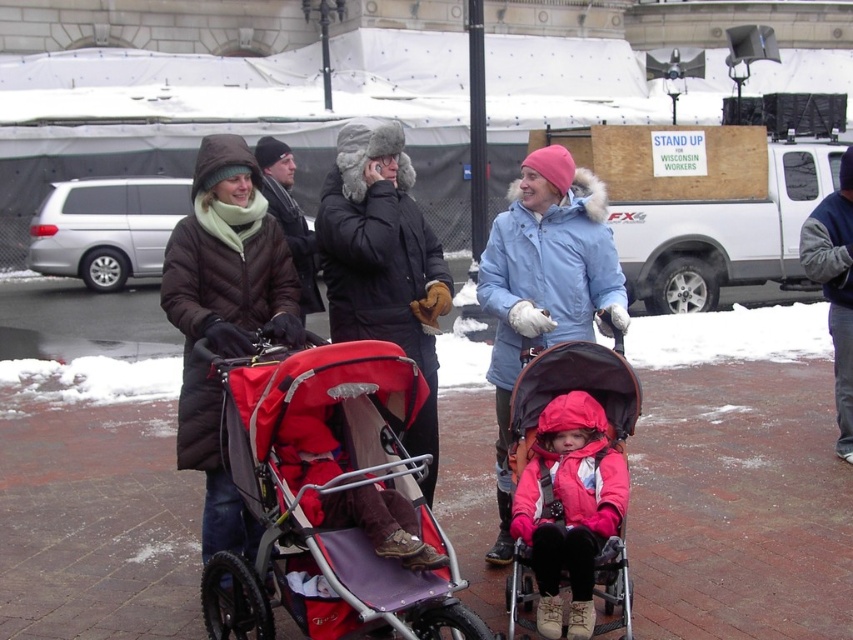
You are a delivery person with a cart that is 8 feet wide. You need to move through the space between the brick pavement at center and the matte red stroller at center. Can your cart fit through that space?

The distance between the brick pavement at center and the matte red stroller at center is 7.99 feet, which is slightly less than the cart width of 8 feet. Therefore, the cart cannot fit through the space between the brick pavement at center and the matte red stroller at center.

You are a delivery person trying to navigate through a narrow alleyway that can only accommodate objects up to 1.2 meters in width. You see the red fabric stroller at center and the matte black coat at center. Which object should you avoid to ensure safe passage?

The red fabric stroller at center might be wider than the matte black coat at center, so to ensure safe passage through the narrow alleyway, you should avoid the red fabric stroller at center.